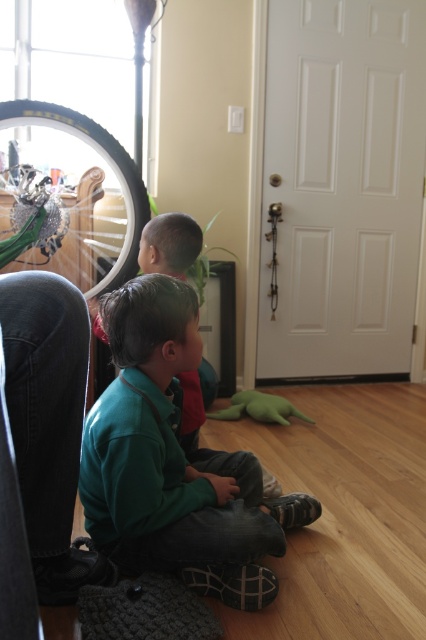
Question: Which object appears farthest from the camera in this image?

Choices:
 (A) shiny metallic bicycle wheel at left
 (B) green plush toy at lower center
 (C) green soft shirt at lower left

Answer: (B)

Question: Which of the following is the farthest from the observer?

Choices:
 (A) (74, 272)
 (B) (290, 413)
 (C) (104, 298)

Answer: (B)

Question: Can you confirm if green soft shirt at lower left is bigger than dark green fabric pants at lower left?

Choices:
 (A) no
 (B) yes

Answer: (B)

Question: Can you confirm if green soft shirt at lower left is positioned above green plush toy at lower center?

Choices:
 (A) yes
 (B) no

Answer: (A)

Question: From the image, what is the correct spatial relationship of shiny metallic bicycle wheel at left in relation to green plush toy at lower center?

Choices:
 (A) left
 (B) right

Answer: (A)

Question: Among these objects, which one is nearest to the camera?

Choices:
 (A) green soft shirt at lower left
 (B) shiny metallic bicycle wheel at left

Answer: (A)